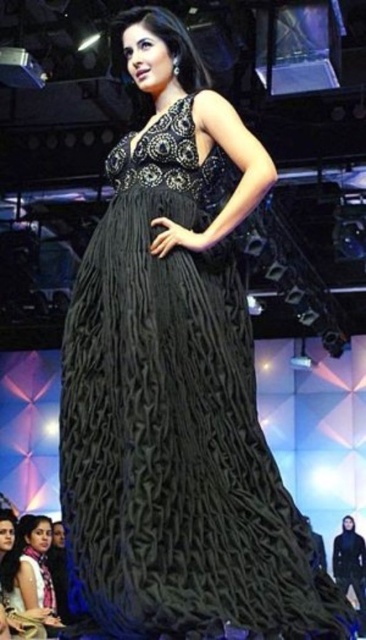
You are a photographer at the event and need to capture the black textured gown at center and the matte black dress at center in a single shot. Which one will appear larger in the photo?

The black textured gown at center will appear larger in the photo because it is closer to the viewer than the matte black dress at center.

You are a photographer at the event and need to capture a photo of both the black textured gown at center and the matte black dress at center in the same frame. Your camera has a maximum focus range of 3 meters. Can you fit both subjects within the camera frame without moving your position?

The black textured gown at center and matte black dress at center are 3.75 meters apart, which exceeds the camera maximum focus range of 3 meters. Therefore, you cannot fit both subjects within the camera frame without moving your position.